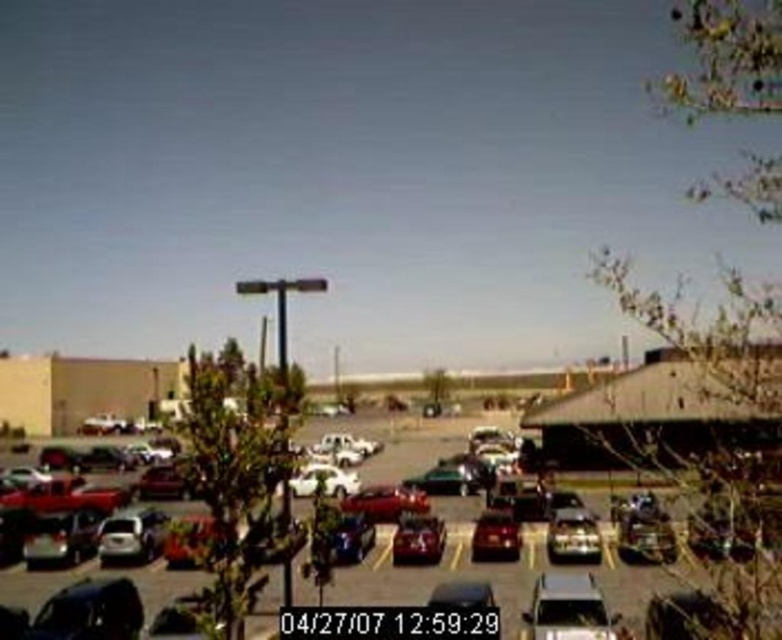
Can you confirm if silver metallic sedan at center is positioned to the left of white matte car at center?

Yes, silver metallic sedan at center is to the left of white matte car at center.

What do you see at coordinates (131, 536) in the screenshot?
I see `silver metallic sedan at center` at bounding box center [131, 536].

Image resolution: width=782 pixels, height=640 pixels. What are the coordinates of `silver metallic sedan at center` in the screenshot? It's located at (131, 536).

Does glossy metallic car at center have a smaller size compared to shiny red car at center?

Yes.

Does point (407, 518) lie behind point (501, 528)?

That is False.

Find the location of a particular element. glossy metallic car at center is located at coordinates (418, 540).

Is point (583, 572) behind point (442, 584)?

That is True.

Who is more distant from viewer, (590, 608) or (443, 589)?

Positioned behind is point (443, 589).

Find the location of a particular element. The width and height of the screenshot is (782, 640). satin silver sedan at center is located at coordinates (567, 609).